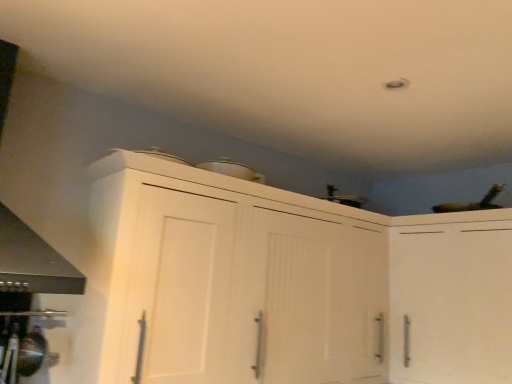
Question: Are white matte cabinet at upper right, the 2th cabinetry in the left-to-right sequence, and white matte cabinet at upper center, which appears as the 2th cabinetry when viewed from the right, far apart?

Choices:
 (A) yes
 (B) no

Answer: (B)

Question: Is white matte cabinet at upper right, the 2th cabinetry in the left-to-right sequence, looking in the opposite direction of white matte cabinet at upper center, which appears as the 2th cabinetry when viewed from the right?

Choices:
 (A) yes
 (B) no

Answer: (B)

Question: Does white matte cabinet at upper right, the 1th cabinetry when ordered from right to left, have a lesser height compared to white matte cabinet at upper center, which is counted as the first cabinetry, starting from the left?

Choices:
 (A) yes
 (B) no

Answer: (A)

Question: Is the depth of white matte cabinet at upper right, the 1th cabinetry when ordered from right to left, less than that of white matte cabinet at upper center, which appears as the 2th cabinetry when viewed from the right?

Choices:
 (A) no
 (B) yes

Answer: (A)

Question: Considering the relative positions of white matte cabinet at upper right, the 1th cabinetry when ordered from right to left, and white matte cabinet at upper center, which appears as the 2th cabinetry when viewed from the right, in the image provided, is white matte cabinet at upper right, the 1th cabinetry when ordered from right to left, behind white matte cabinet at upper center, which appears as the 2th cabinetry when viewed from the right,?

Choices:
 (A) yes
 (B) no

Answer: (A)

Question: Is white matte cabinet at upper right, the 2th cabinetry in the left-to-right sequence, at the left side of white matte cabinet at upper center, which appears as the 2th cabinetry when viewed from the right?

Choices:
 (A) no
 (B) yes

Answer: (A)

Question: Is white matte cabinet at upper center, which is counted as the first cabinetry, starting from the left, not near white matte cabinet at upper right, the 1th cabinetry when ordered from right to left?

Choices:
 (A) yes
 (B) no

Answer: (B)

Question: Can you confirm if white matte cabinet at upper center, which is counted as the first cabinetry, starting from the left, is smaller than white matte cabinet at upper right, the 2th cabinetry in the left-to-right sequence?

Choices:
 (A) yes
 (B) no

Answer: (B)

Question: Is the position of white matte cabinet at upper center, which is counted as the first cabinetry, starting from the left, less distant than that of white matte cabinet at upper right, the 1th cabinetry when ordered from right to left?

Choices:
 (A) yes
 (B) no

Answer: (A)

Question: Is white matte cabinet at upper center, which is counted as the first cabinetry, starting from the left, shorter than white matte cabinet at upper right, the 2th cabinetry in the left-to-right sequence?

Choices:
 (A) no
 (B) yes

Answer: (A)

Question: From a real-world perspective, is white matte cabinet at upper center, which appears as the 2th cabinetry when viewed from the right, over white matte cabinet at upper right, the 1th cabinetry when ordered from right to left?

Choices:
 (A) yes
 (B) no

Answer: (A)

Question: Does white matte cabinet at upper center, which is counted as the first cabinetry, starting from the left, lie behind white matte cabinet at upper right, the 1th cabinetry when ordered from right to left?

Choices:
 (A) no
 (B) yes

Answer: (A)

Question: Based on their sizes in the image, would you say white matte cabinet at upper center, which is counted as the first cabinetry, starting from the left, is bigger or smaller than white matte cabinet at upper right, the 1th cabinetry when ordered from right to left?

Choices:
 (A) big
 (B) small

Answer: (A)